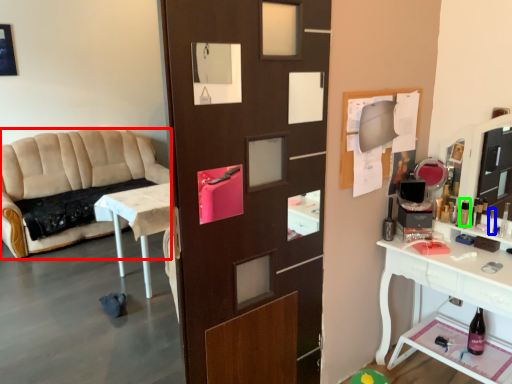
Question: Which object is the closest to the studio couch (highlighted by a red box)? Choose among these: toiletry (highlighted by a blue box) or toiletry (highlighted by a green box).

Choices:
 (A) toiletry
 (B) toiletry

Answer: (B)